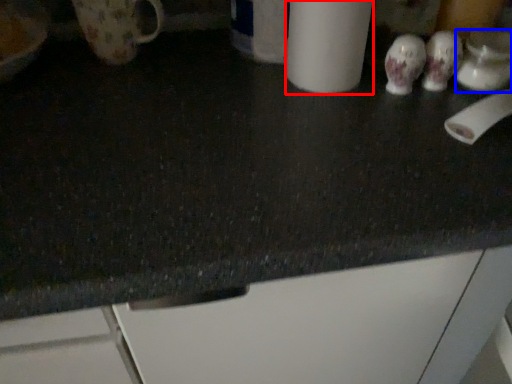
Question: Which point is closer to the camera, paper towel (highlighted by a red box) or mug (highlighted by a blue box)?

Choices:
 (A) paper towel
 (B) mug

Answer: (A)